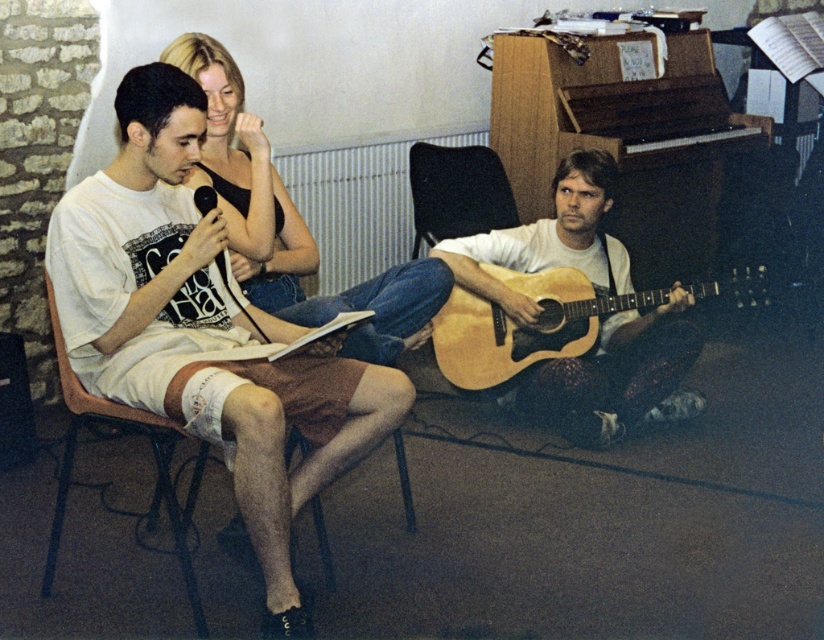
Question: Which object is farther from the camera taking this photo?

Choices:
 (A) light brown wooden guitar at lower right
 (B) white cotton shorts at center

Answer: (A)

Question: Does wooden acoustic guitar at lower right have a smaller size compared to matte black tank top at upper left?

Choices:
 (A) no
 (B) yes

Answer: (B)

Question: Can you confirm if wooden acoustic guitar at lower right is bigger than matte black tank top at upper left?

Choices:
 (A) yes
 (B) no

Answer: (B)

Question: Is wooden acoustic guitar at lower right wider than matte black tank top at upper left?

Choices:
 (A) no
 (B) yes

Answer: (B)

Question: Which point appears farthest from the camera in this image?

Choices:
 (A) (691, 291)
 (B) (284, 305)

Answer: (A)

Question: Among these objects, which one is farthest from the camera?

Choices:
 (A) wooden acoustic guitar at lower right
 (B) white cotton shorts at center

Answer: (A)